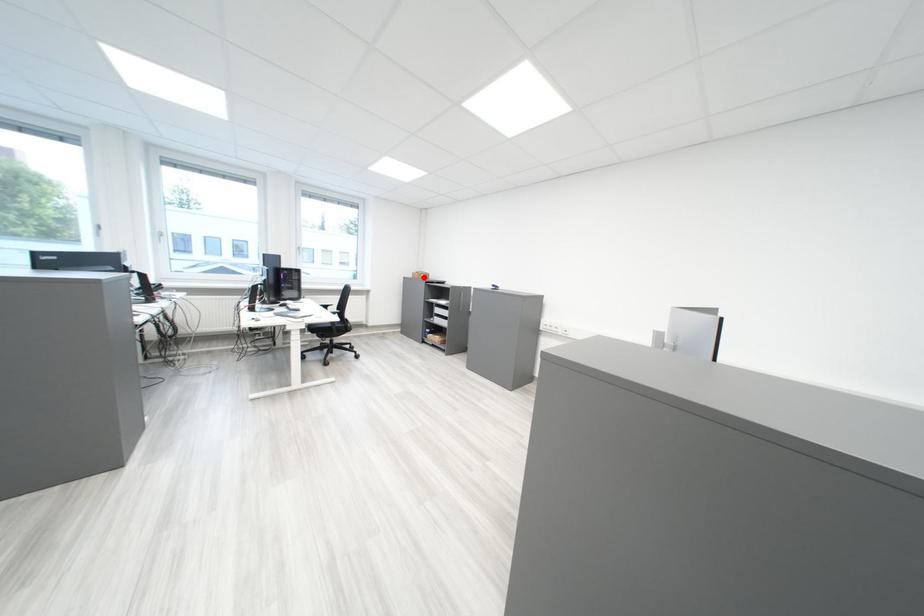
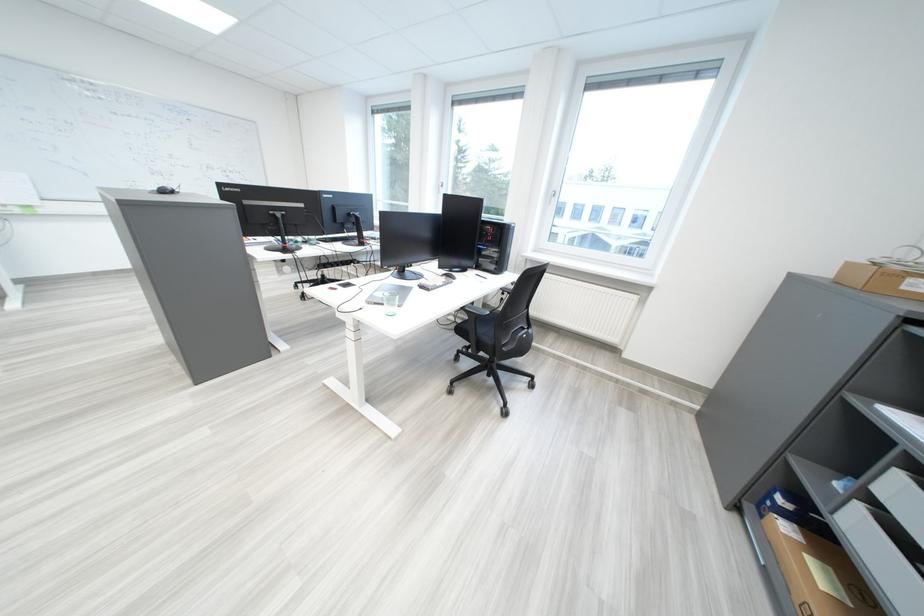
Locate, in the second image, the point that corresponds to the highlighted location in the first image.

(839, 274)